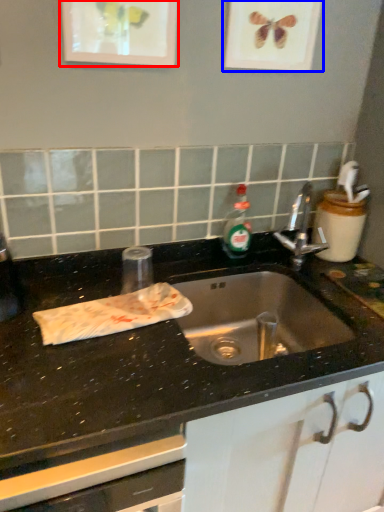
Question: Which object appears farthest to the camera in this image, picture frame (highlighted by a red box) or picture frame (highlighted by a blue box)?

Choices:
 (A) picture frame
 (B) picture frame

Answer: (B)